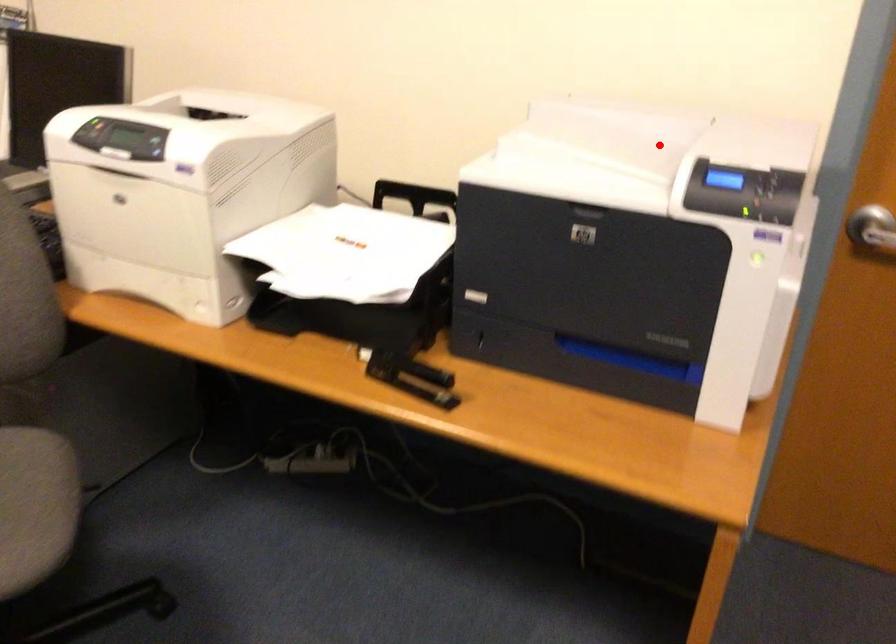
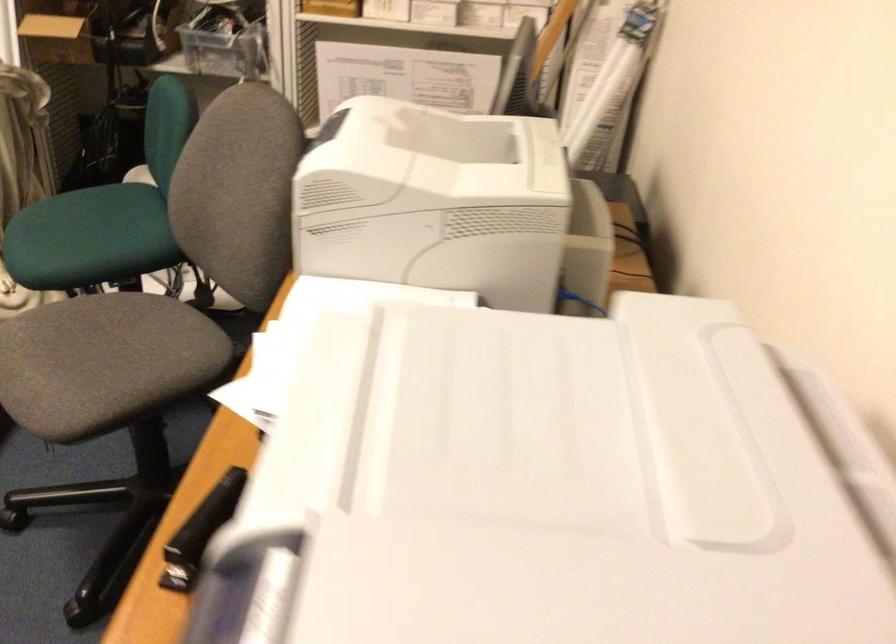
In the second image, find the point that corresponds to the highlighted location in the first image.

(593, 491)